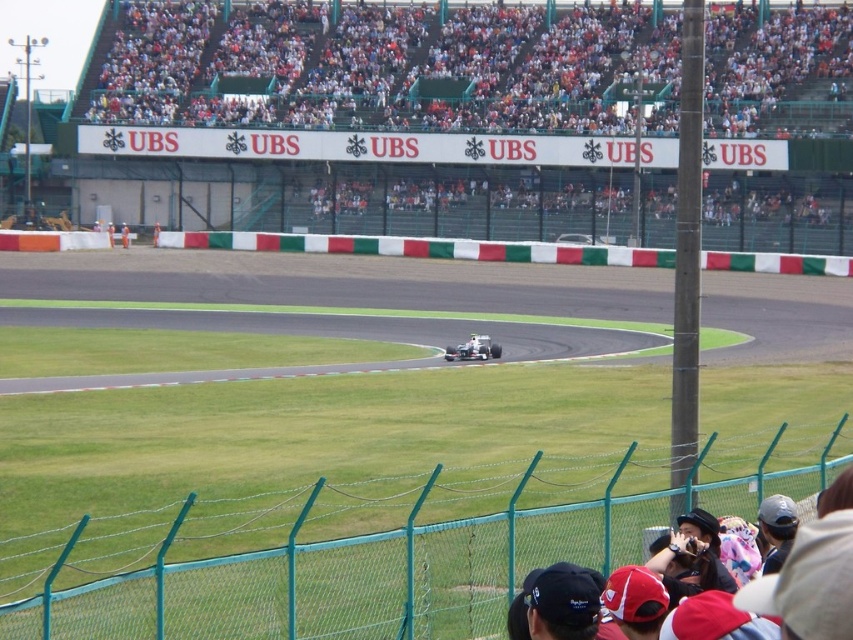
You are a drone operator tasked with capturing aerial footage of the Formula One race. Your drone is currently at the white plastic seats at upper center. To ensure safety, you need to move the drone away from the track. In which direction should you move the drone relative to the grandstand?

The white plastic seats at upper center is located at point (389, 67), so you should move the drone away from the track towards the grandstand spectators area to ensure safety.

You are a photographer at the Formula One race track. You need to take a photo of the orange fabric person at center and the white plastic helmet at center. Which object should you focus on first to ensure it appears sharp in the photo?

The orange fabric person at center is further to the viewer than the white plastic helmet at center, so you should focus on the orange fabric person at center first to ensure it appears sharp in the photo.

You are a photographer standing at the edge of the Formula One race track. You notice two objects in the center of your viewfinder, an orange fabric person at center and a white plastic helmet at center. Which one is positioned to the right?

The orange fabric person at center is positioned to the right of the white plastic helmet at center.